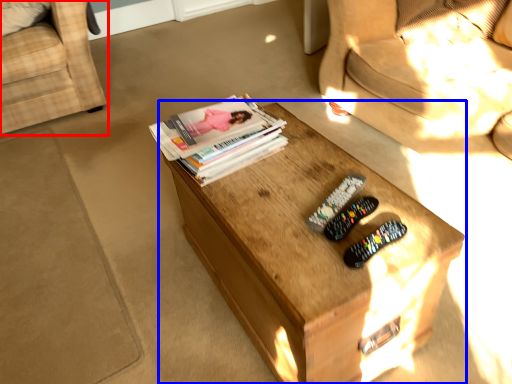
Question: Which of the following is the closest to the observer, chair (highlighted by a red box) or table (highlighted by a blue box)?

Choices:
 (A) chair
 (B) table

Answer: (B)